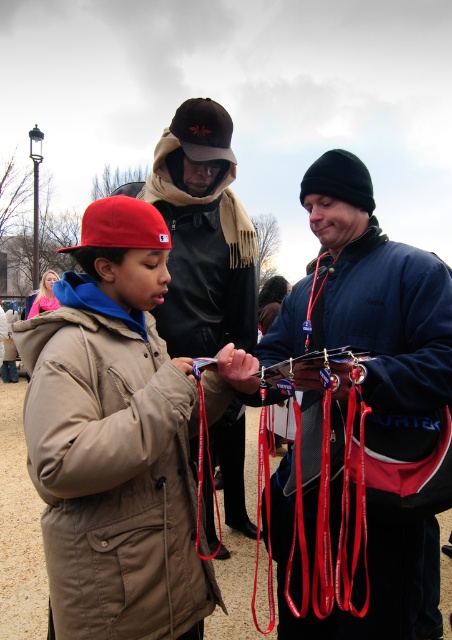
Question: Does matte khaki jacket at center appear under velvet blue jacket at center?

Choices:
 (A) yes
 (B) no

Answer: (A)

Question: Estimate the real-world distances between objects in this image. Which object is closer to the dark brown leather jacket at center?

Choices:
 (A) velvet blue jacket at center
 (B) matte khaki jacket at center

Answer: (B)

Question: Which point is farther to the camera?

Choices:
 (A) (378, 275)
 (B) (51, 465)

Answer: (A)

Question: Which point is closer to the camera taking this photo?

Choices:
 (A) (282, 616)
 (B) (213, 138)
 (C) (81, 348)

Answer: (C)

Question: Is velvet blue jacket at center to the left of dark brown leather jacket at center from the viewer's perspective?

Choices:
 (A) yes
 (B) no

Answer: (B)

Question: Where is matte khaki jacket at center located in relation to dark brown leather jacket at center in the image?

Choices:
 (A) right
 (B) left

Answer: (B)